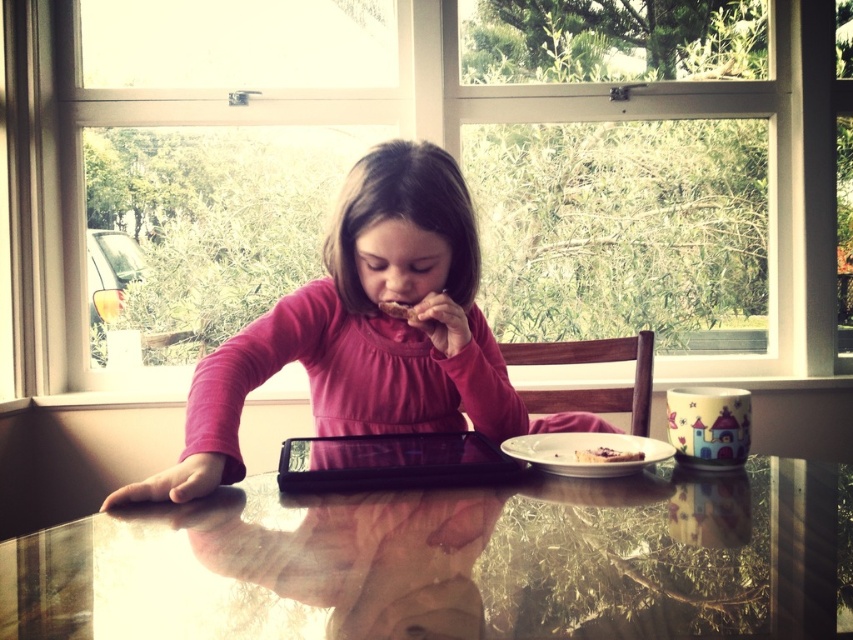
You are a guest at this table and want to reach both the black glossy tablet at center and the smooth chocolate cake at center. Which object should you reach for first if you want to grab the one closer to you?

The black glossy tablet at center is to the left of smooth chocolate cake at center, so depending on your position, the closer object might be either. However, since both are at center, they are likely equidistant from you. Please clarify your position.

You are standing in the room and see the point at coordinates point (270, 572). If you want to place a small vase there, will it be visible to someone standing directly in front of the window?

The point at coordinates point (270, 572) is 23.62 inches away from the viewer, so yes, placing a small vase there would be visible to someone standing directly in front of the window since it is within a reasonable viewing distance.

You are a housekeeper cleaning the table. The glossy glass table at center is to the right of the brown crumbly snack at center. Which object should you clean first if you start from the left side of the table?

You should start by cleaning the brown crumbly snack at center because it is located to the left of the glossy glass table at center.